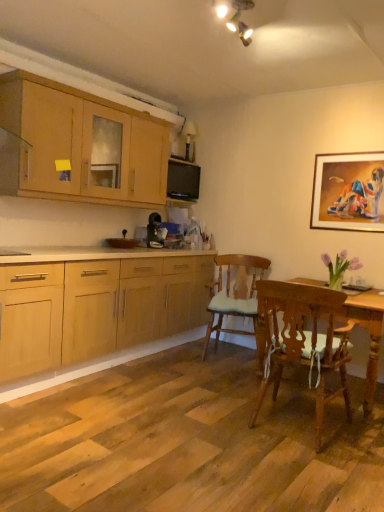
Question: Considering the relative sizes of wooden chair with white cushion at lower right, marked as the second chair in a back-to-front arrangement, and light wood cabinet at upper left in the image provided, is wooden chair with white cushion at lower right, marked as the second chair in a back-to-front arrangement, shorter than light wood cabinet at upper left?

Choices:
 (A) no
 (B) yes

Answer: (A)

Question: Is wooden chair with white cushion at lower right, placed as the first chair when sorted from front to back, positioned behind light wood cabinet at upper left?

Choices:
 (A) no
 (B) yes

Answer: (A)

Question: Does wooden chair with white cushion at lower right, marked as the second chair in a back-to-front arrangement, come in front of light wood cabinet at upper left?

Choices:
 (A) no
 (B) yes

Answer: (B)

Question: From a real-world perspective, does wooden chair with white cushion at lower right, marked as the second chair in a back-to-front arrangement, stand above light wood cabinet at upper left?

Choices:
 (A) yes
 (B) no

Answer: (B)

Question: Does wooden chair with white cushion at lower right, marked as the second chair in a back-to-front arrangement, touch light wood cabinet at upper left?

Choices:
 (A) yes
 (B) no

Answer: (B)

Question: Does wooden chair with white cushion at lower right, marked as the second chair in a back-to-front arrangement, have a smaller size compared to light wood cabinet at upper left?

Choices:
 (A) yes
 (B) no

Answer: (A)

Question: Is wooden chair with cushion at center, the 1th chair when ordered from back to front, taller than wooden chair with white cushion at lower right, marked as the second chair in a back-to-front arrangement?

Choices:
 (A) no
 (B) yes

Answer: (B)

Question: Does wooden chair with cushion at center, positioned as the 2th chair in front-to-back order, have a larger size compared to wooden chair with white cushion at lower right, marked as the second chair in a back-to-front arrangement?

Choices:
 (A) no
 (B) yes

Answer: (B)

Question: Could you tell me if wooden chair with cushion at center, the 1th chair when ordered from back to front, is facing wooden chair with white cushion at lower right, placed as the first chair when sorted from front to back?

Choices:
 (A) yes
 (B) no

Answer: (A)

Question: Is wooden chair with cushion at center, the 1th chair when ordered from back to front, located outside wooden chair with white cushion at lower right, marked as the second chair in a back-to-front arrangement?

Choices:
 (A) no
 (B) yes

Answer: (B)

Question: Is wooden chair with white cushion at lower right, marked as the second chair in a back-to-front arrangement, inside wooden chair with cushion at center, the 1th chair when ordered from back to front?

Choices:
 (A) yes
 (B) no

Answer: (B)

Question: From the image's perspective, is wooden chair with cushion at center, positioned as the 2th chair in front-to-back order, under wooden chair with white cushion at lower right, marked as the second chair in a back-to-front arrangement?

Choices:
 (A) no
 (B) yes

Answer: (A)

Question: Is black glossy microwave oven at upper center located outside light wood cabinet at upper left?

Choices:
 (A) no
 (B) yes

Answer: (B)